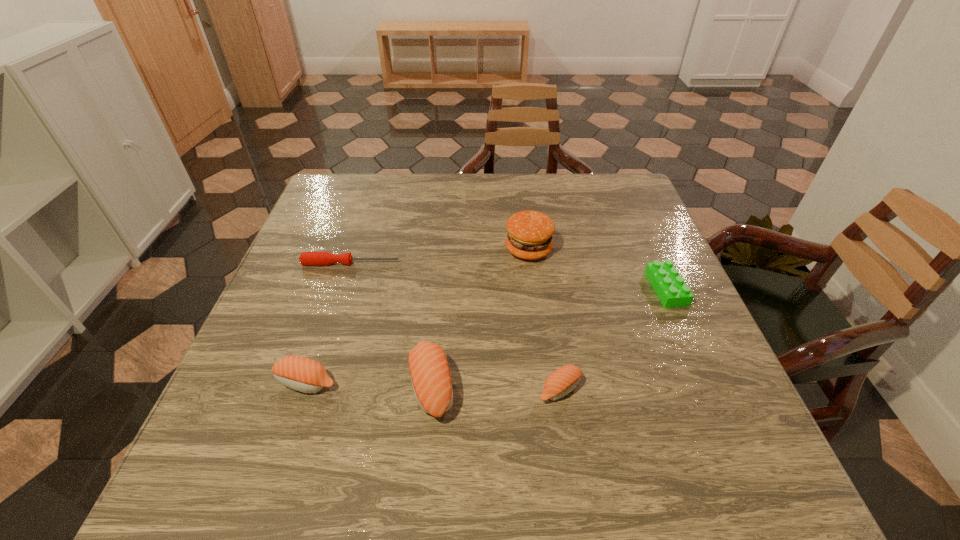
You are a GUI agent. You are given a task and a screenshot of the screen. Output one action in this format:
    pyautogui.click(x=<x>, y=<y>)
    Task: Click on the third tallest object
    The image size is (960, 540).
    Given the screenshot: What is the action you would take?
    pyautogui.click(x=302, y=374)

The image size is (960, 540). I want to click on the leftmost sushi, so click(302, 374).

This screenshot has width=960, height=540. In order to click on the fourth object from right to left in this screenshot , I will do `click(431, 379)`.

You are a GUI agent. You are given a task and a screenshot of the screen. Output one action in this format:
    pyautogui.click(x=<x>, y=<y>)
    Task: Click on the second sushi from left to right
    The height and width of the screenshot is (540, 960).
    Given the screenshot: What is the action you would take?
    pyautogui.click(x=431, y=379)

The height and width of the screenshot is (540, 960). What are the coordinates of `the rightmost sushi` in the screenshot? It's located at (561, 382).

Identify the location of patty. (529, 236).

The height and width of the screenshot is (540, 960). Find the location of `screwdriver`. screwdriver is located at coordinates (306, 258).

At what (x,y) coordinates should I click in order to perform the action: click on the third farthest object. Please return your answer as a coordinate pair (x, y). This screenshot has width=960, height=540. Looking at the image, I should click on (670, 287).

At what (x,y) coordinates should I click in order to perform the action: click on Lego. Please return your answer as a coordinate pair (x, y). Looking at the image, I should click on (670, 287).

This screenshot has height=540, width=960. Identify the location of free location located 0.080m on the right of the third tallest object. (380, 382).